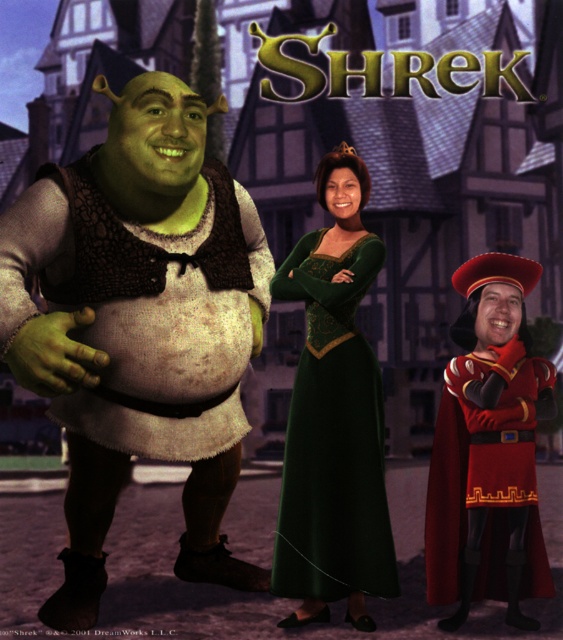
Is brown textured vest at left bigger than green velvet dress at center?

Correct, brown textured vest at left is larger in size than green velvet dress at center.

Which of these two, brown textured vest at left or green velvet dress at center, stands shorter?

Standing shorter between the two is brown textured vest at left.

Locate an element on the screen. brown textured vest at left is located at coordinates (140, 324).

How distant is shiny red armor at right from green velvet dress at center?

shiny red armor at right is 28.85 inches away from green velvet dress at center.

Between shiny red armor at right and green velvet dress at center, which one has more height?

With more height is shiny red armor at right.

Between point (482, 289) and point (359, 570), which one is positioned behind?

The point (482, 289) is more distant.

Locate an element on the screen. shiny red armor at right is located at coordinates (489, 449).

Is brown textured vest at left to the right of shiny red armor at right from the viewer's perspective?

Incorrect, brown textured vest at left is not on the right side of shiny red armor at right.

In order to click on brown textured vest at left in this screenshot , I will do `click(140, 324)`.

Where is `brown textured vest at left`? This screenshot has height=640, width=563. brown textured vest at left is located at coordinates (140, 324).

Where is `brown textured vest at left`? The width and height of the screenshot is (563, 640). brown textured vest at left is located at coordinates (140, 324).